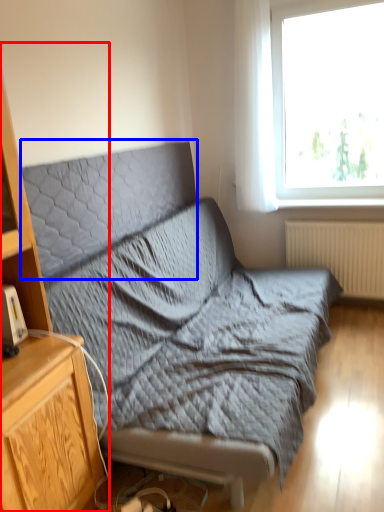
Question: Among these objects, which one is farthest to the camera, cabinetry (highlighted by a red box) or pillow (highlighted by a blue box)?

Choices:
 (A) cabinetry
 (B) pillow

Answer: (B)